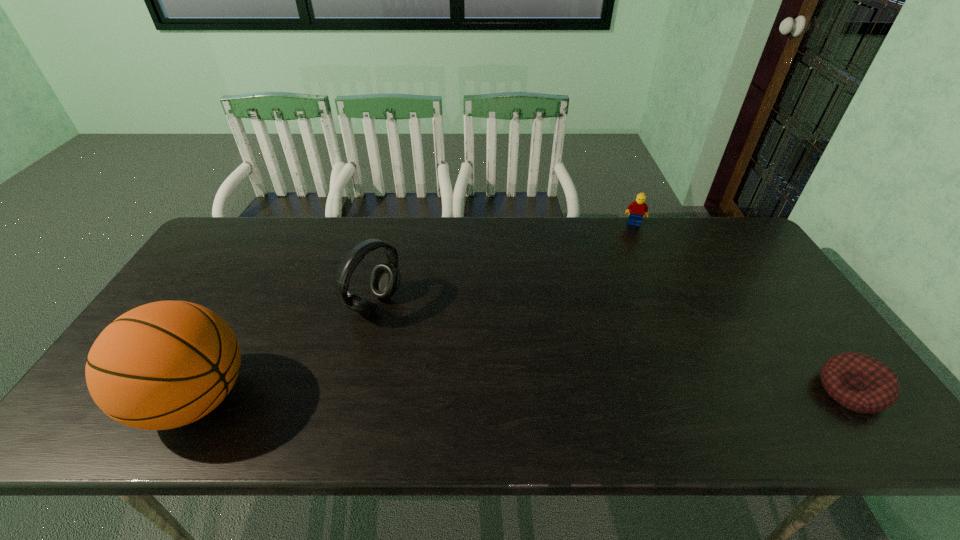
Where is `blank space that satisfies the following two spatial constraints: 1. on the front side of the third shortest object; 2. on the right side of the beanbag`? This screenshot has height=540, width=960. blank space that satisfies the following two spatial constraints: 1. on the front side of the third shortest object; 2. on the right side of the beanbag is located at coordinates (353, 390).

Find the location of a particular element. The image size is (960, 540). vacant position in the image that satisfies the following two spatial constraints: 1. on the front side of the beanbag; 2. on the left side of the third nearest object is located at coordinates (353, 390).

The height and width of the screenshot is (540, 960). What are the coordinates of `vacant point that satisfies the following two spatial constraints: 1. on the back side of the second farthest object; 2. on the right side of the tallest object` in the screenshot? It's located at (247, 305).